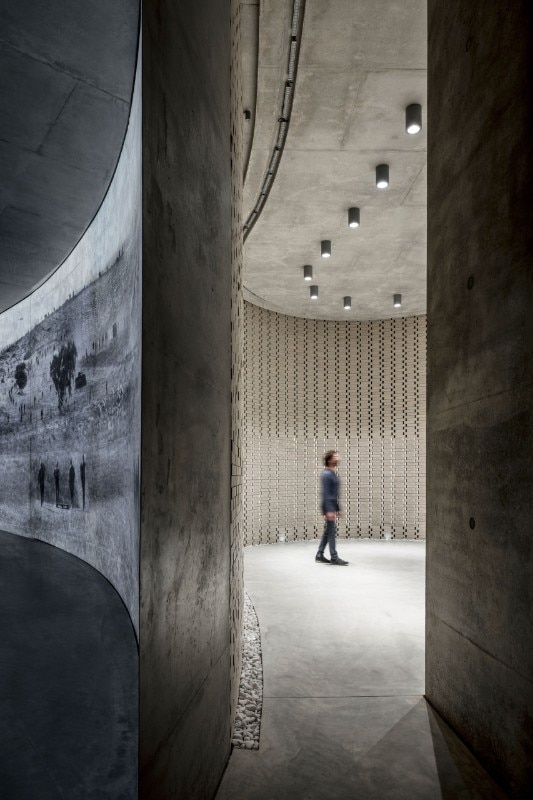
Where is `ceiling`? The image size is (533, 800). ceiling is located at coordinates point(282,246).